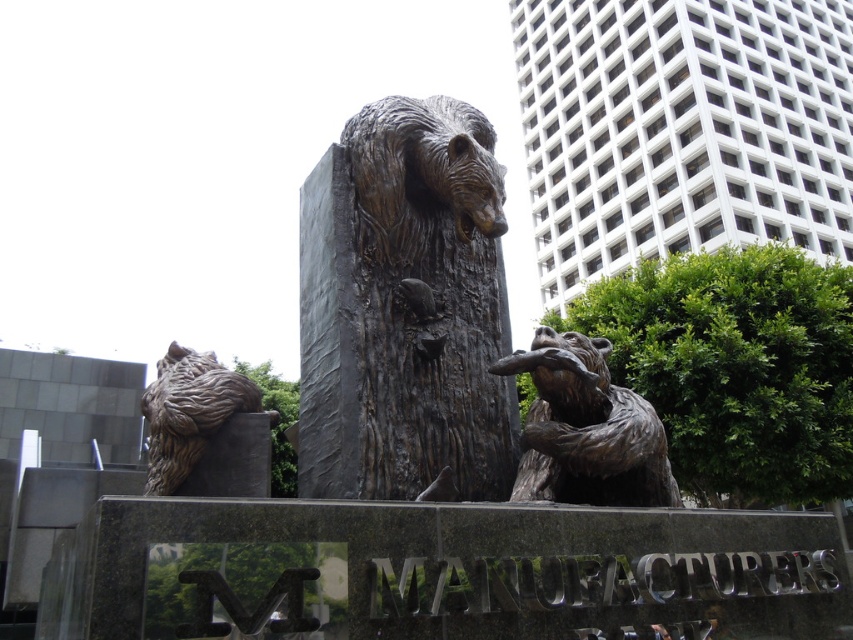
You are an art installer setting up the sculpture. The safety guidelines require that the distance between the bronze textured bear at center and the green matte tree at lower center must be at least 2 meters to ensure stability. Is the current placement compliant with the guidelines?

The bronze textured bear at center is 2.14 meters away from the green matte tree at lower center, which exceeds the minimum required distance of 2 meters. Therefore, the current placement complies with the safety guidelines.

You are standing in front of the sculpture and want to locate the bronze textured bear at center. According to the coordinates provided, where would you look to find it?

The bronze textured bear at center is located at point coordinates (404, 307).